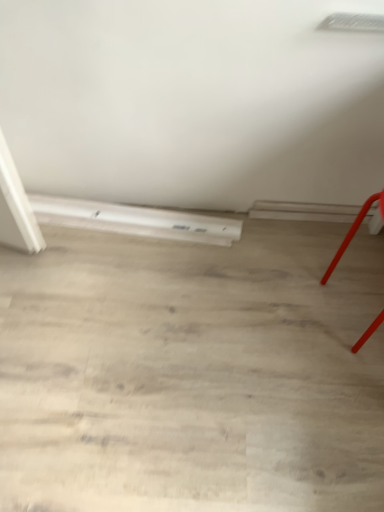
Where is `vacant space that is to the left of smooth red chair at right`? The image size is (384, 512). vacant space that is to the left of smooth red chair at right is located at coordinates (285, 306).